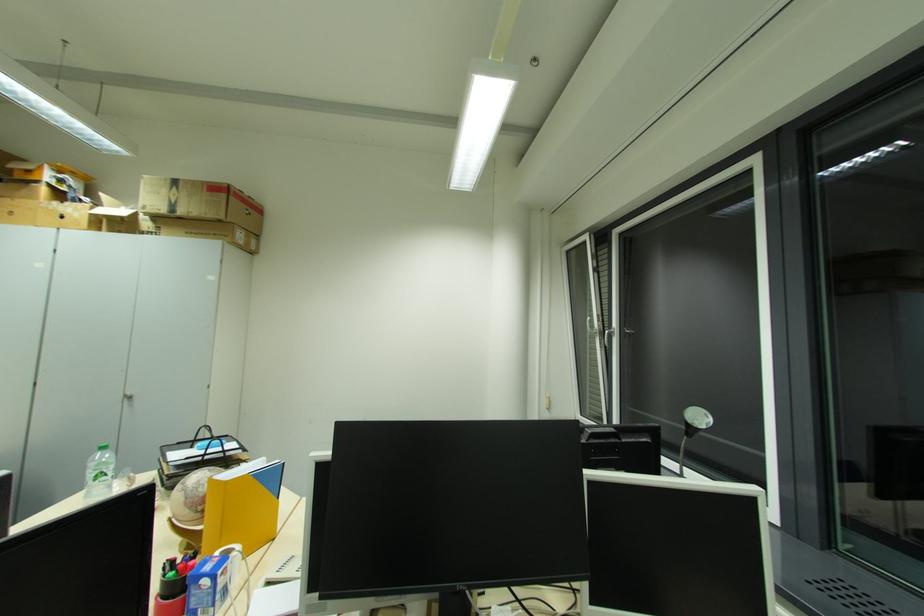
This screenshot has width=924, height=616. What are the coordinates of `red pen` in the screenshot? It's located at (174, 585).